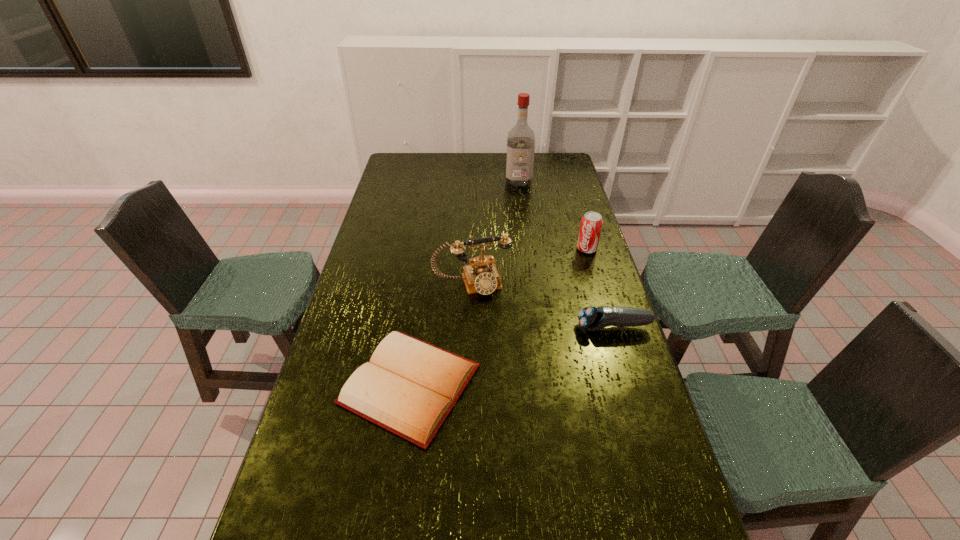
The width and height of the screenshot is (960, 540). Identify the location of blank area in the image that satisfies the following two spatial constraints: 1. on the front side of the electric shaver; 2. on the head of the third farthest object. (471, 327).

This screenshot has width=960, height=540. Find the location of `free space that satisfies the following two spatial constraints: 1. on the back side of the tallest object; 2. on the right side of the Bible`. free space that satisfies the following two spatial constraints: 1. on the back side of the tallest object; 2. on the right side of the Bible is located at coordinates (439, 181).

Where is `vacant space that satisfies the following two spatial constraints: 1. on the back side of the shortest object; 2. on the left side of the third shortest object`? This screenshot has width=960, height=540. vacant space that satisfies the following two spatial constraints: 1. on the back side of the shortest object; 2. on the left side of the third shortest object is located at coordinates (429, 249).